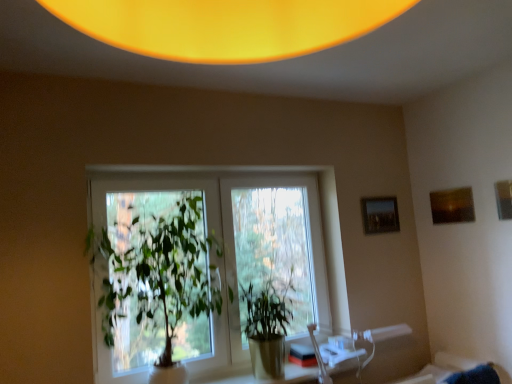
Question: From the image's perspective, relative to translucent glass table at center, is green leafy plant at center, which is the 2th houseplant from right to left, above or below?

Choices:
 (A) below
 (B) above

Answer: (B)

Question: Considering the positions of point (157, 283) and point (338, 365), is point (157, 283) closer or farther from the camera than point (338, 365)?

Choices:
 (A) farther
 (B) closer

Answer: (B)

Question: Which object is the farthest from the green leafy plant at center, the first houseplant from the left?

Choices:
 (A) matte brown picture frame at upper right, which is the 2th picture frame from left to right
 (B) clear glass window at center
 (C) translucent glass table at center
 (D) matte black picture frame at upper right, the 1th picture frame when ordered from left to right
 (E) green glossy plant at center, acting as the 2th houseplant starting from the left

Answer: (A)

Question: Which is farther from the matte black picture frame at upper right, the third picture frame from the front?

Choices:
 (A) clear glass window at center
 (B) translucent glass table at center
 (C) green leafy plant at center, the first houseplant from the left
 (D) matte brown picture frame at upper right, which is the 2th picture frame from left to right
 (E) wooden picture frame at upper right, the 1th picture frame in the front-to-back sequence

Answer: (C)